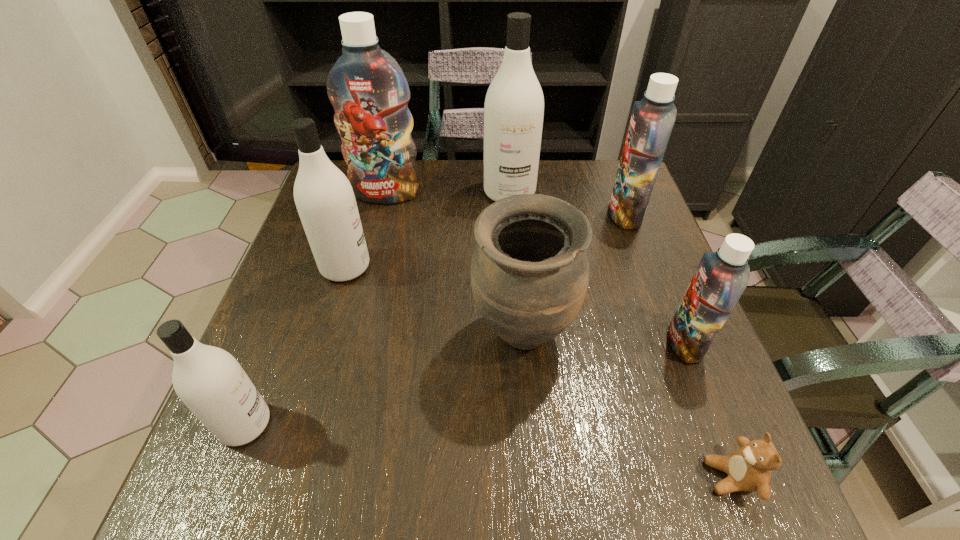
Identify the location of the biggest white shampoo. (514, 105).

The height and width of the screenshot is (540, 960). I want to click on the farthest white shampoo, so click(x=514, y=105).

In order to click on the biggest blue shampoo in this screenshot , I will do (369, 92).

Identify the location of the second biggest blue shampoo. The height and width of the screenshot is (540, 960). (652, 120).

I want to click on the fourth farthest object, so click(324, 197).

At what (x,y) coordinates should I click in order to perform the action: click on the third nearest shampoo. Please return your answer as a coordinate pair (x, y). This screenshot has width=960, height=540. Looking at the image, I should click on (324, 197).

This screenshot has height=540, width=960. What are the coordinates of `urn` in the screenshot? It's located at (530, 268).

I want to click on the smallest blue shampoo, so click(x=721, y=277).

Where is `the second nearest shampoo`? The height and width of the screenshot is (540, 960). the second nearest shampoo is located at coordinates (721, 277).

The width and height of the screenshot is (960, 540). I want to click on the nearest white shampoo, so click(209, 380).